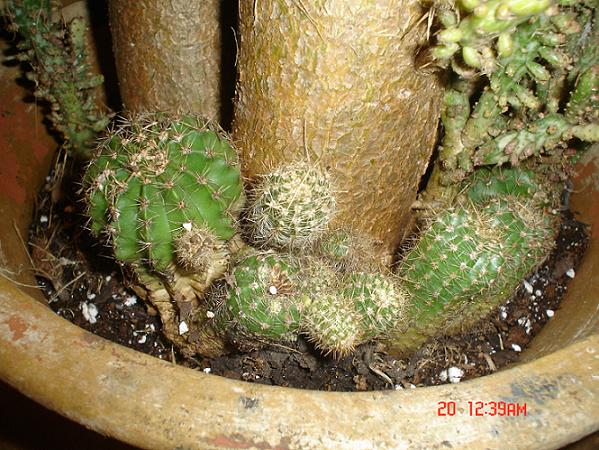
Locate an element on the screen. The height and width of the screenshot is (450, 599). pot is located at coordinates (86, 382).